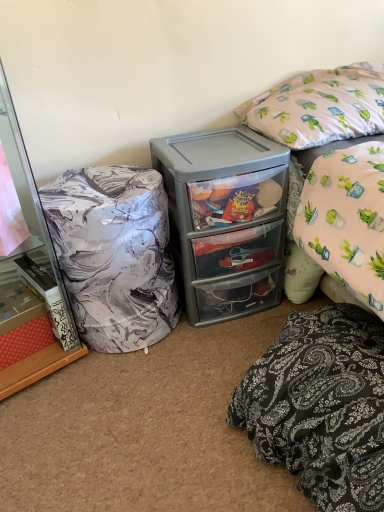
The height and width of the screenshot is (512, 384). Identify the location of vacant space in front of marble-patterned bean bag at left. (123, 394).